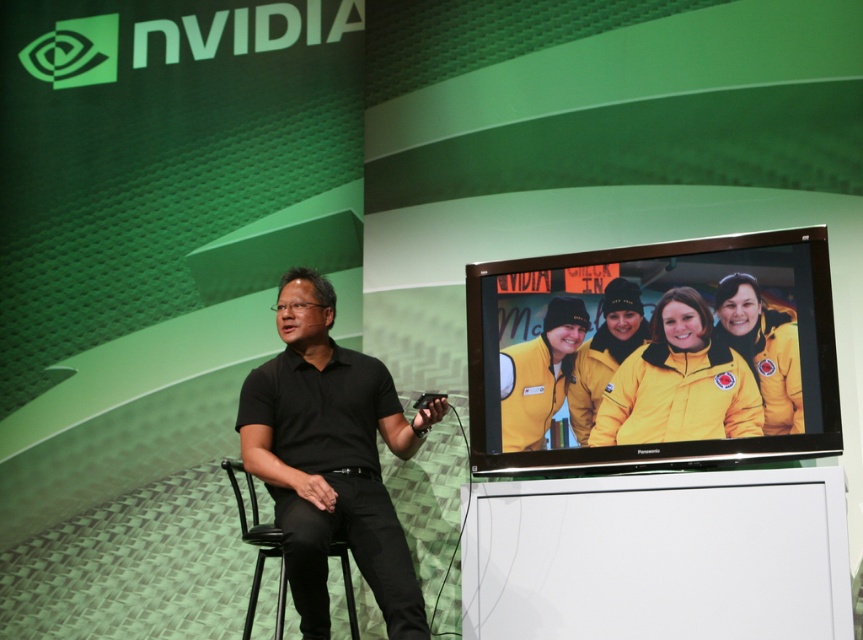
Question: Which of the following is the farthest from the observer?

Choices:
 (A) (249, 628)
 (B) (394, 608)
 (C) (557, 304)

Answer: (C)

Question: Which point is closer to the camera?

Choices:
 (A) (313, 557)
 (B) (559, 333)

Answer: (A)

Question: Is black matte shirt at center wider than black plastic chair at center?

Choices:
 (A) no
 (B) yes

Answer: (B)

Question: Can you confirm if yellow fabric screen at right is positioned below black matte shirt at center?

Choices:
 (A) yes
 (B) no

Answer: (B)

Question: Which point appears closest to the camera in this image?

Choices:
 (A) (250, 604)
 (B) (693, 419)
 (C) (369, 376)

Answer: (B)

Question: Does yellow fabric screen at right appear on the right side of black plastic chair at center?

Choices:
 (A) yes
 (B) no

Answer: (A)